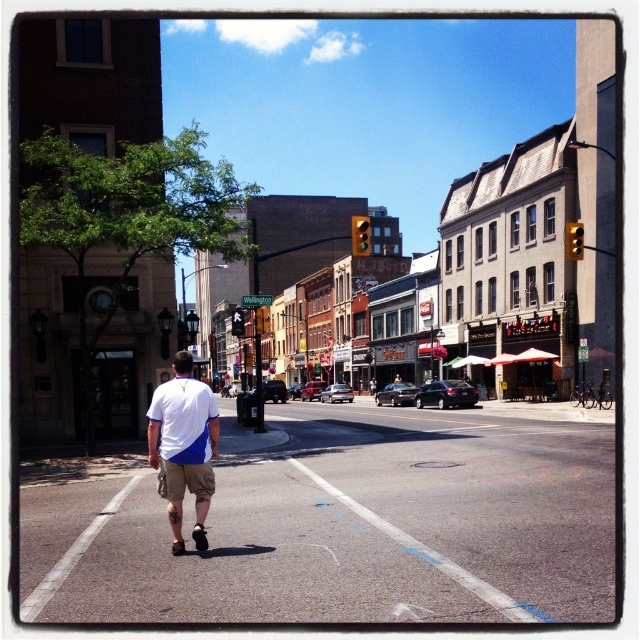
Question: Which of these objects is positioned farthest from the yellow glass traffic light at center?

Choices:
 (A) yellow plastic traffic light at upper right
 (B) yellow glass pedestrian signal at center
 (C) khaki shorts at center

Answer: (C)

Question: Which is nearer to the yellow glass traffic light at center?

Choices:
 (A) khaki shorts at center
 (B) yellow glass pedestrian signal at center

Answer: (B)

Question: Can you confirm if yellow plastic traffic light at center is positioned below yellow plastic traffic light at upper right?

Choices:
 (A) no
 (B) yes

Answer: (A)

Question: From the image, what is the correct spatial relationship of yellow plastic traffic light at center in relation to yellow glass pedestrian signal at center?

Choices:
 (A) right
 (B) left

Answer: (A)

Question: Considering the relative positions of yellow plastic traffic light at center and yellow glass pedestrian signal at center in the image provided, where is yellow plastic traffic light at center located with respect to yellow glass pedestrian signal at center?

Choices:
 (A) left
 (B) right

Answer: (B)

Question: Which point appears farthest from the camera in this image?

Choices:
 (A) (230, 316)
 (B) (264, 307)

Answer: (A)